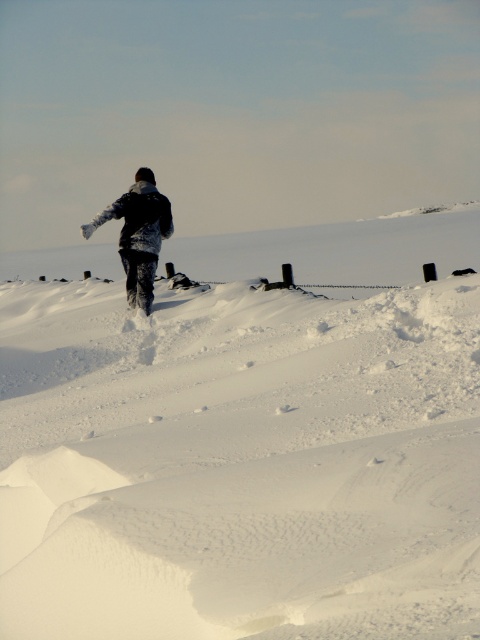
Question: Which point appears closest to the camera in this image?

Choices:
 (A) (108, 323)
 (B) (115, 200)

Answer: (A)

Question: Is the position of white fluffy snow at center more distant than that of snow-covered jacket at center?

Choices:
 (A) no
 (B) yes

Answer: (A)

Question: Among these objects, which one is farthest from the camera?

Choices:
 (A) white fluffy snow at center
 (B) snow-covered jacket at center

Answer: (B)

Question: Does white fluffy snow at center appear over snow-covered jacket at center?

Choices:
 (A) no
 (B) yes

Answer: (B)

Question: Is white fluffy snow at center positioned in front of snow-covered jacket at center?

Choices:
 (A) yes
 (B) no

Answer: (A)